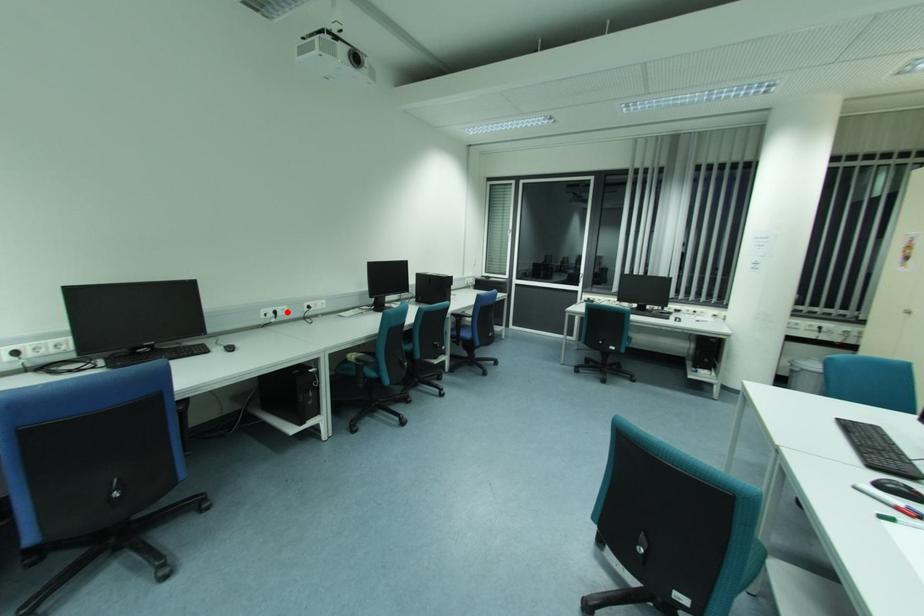
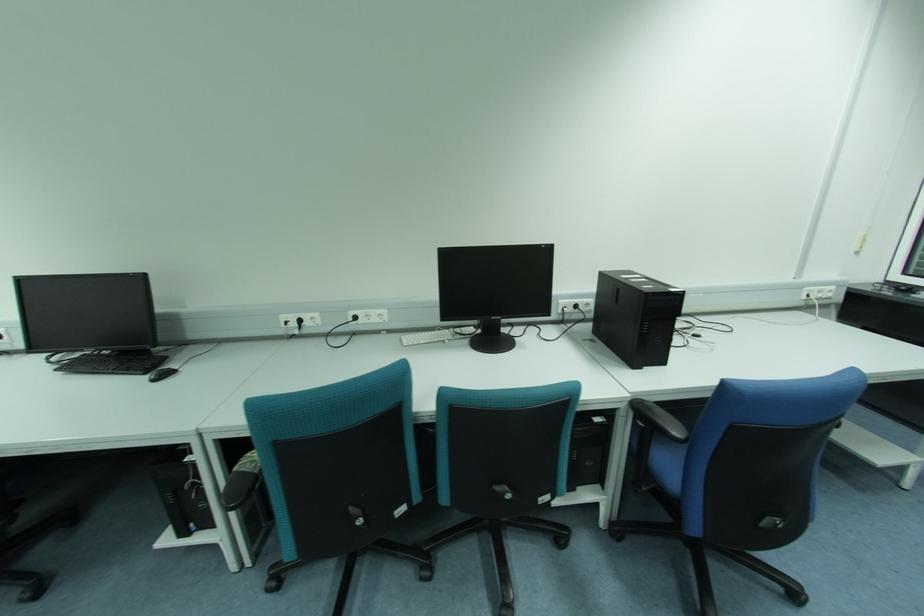
Find the pixel in the second image that matches the highlighted location in the first image.

(319, 322)